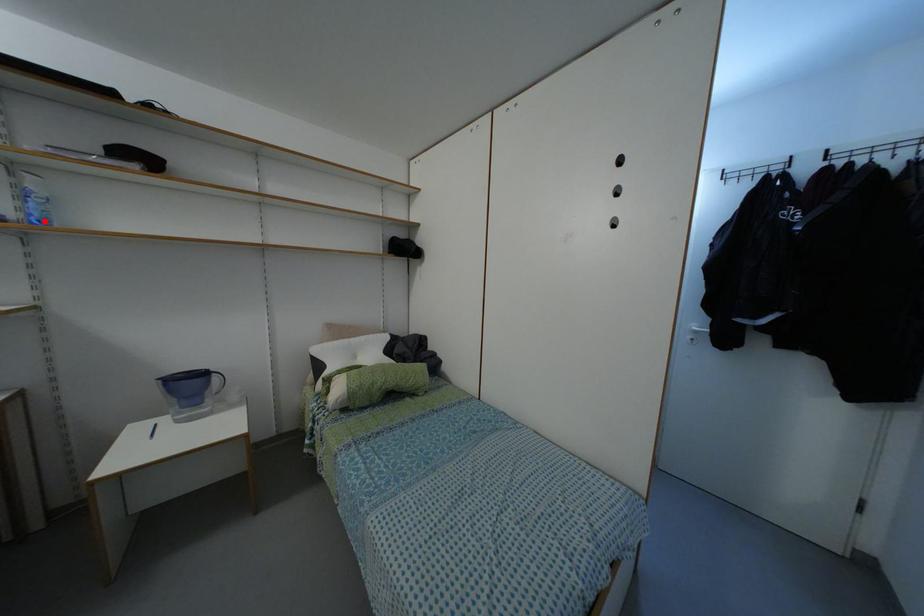
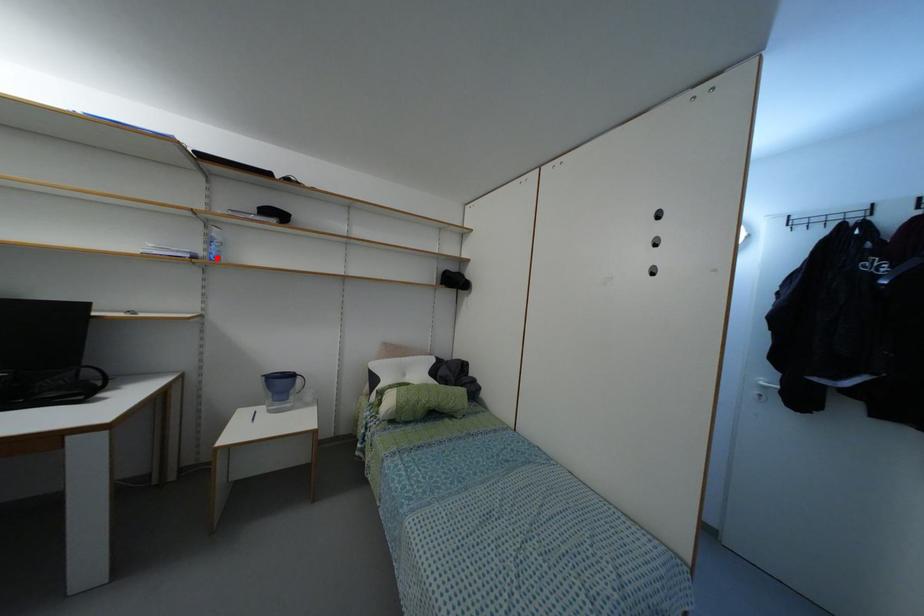
Based on the photo, I am providing you with two images of the same scene from different viewpoints. A red point is marked on the first image and another point is marked on the second image. Is the red point in image1 aligned with the point shown in image2?

Yes